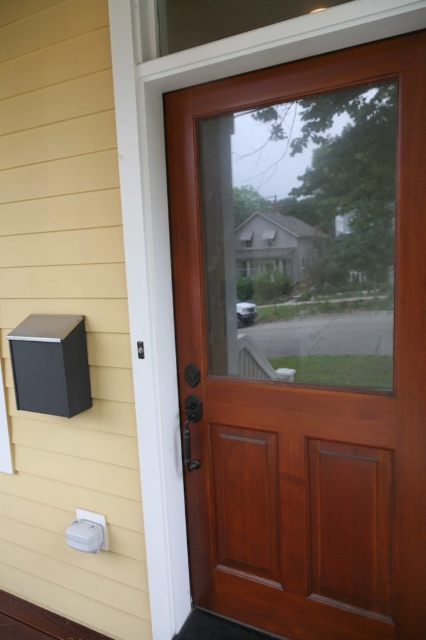
Between mahogany wood screen door at center and yellow siding at left, which one is positioned lower?

mahogany wood screen door at center

How much distance is there between mahogany wood screen door at center and yellow siding at left?

mahogany wood screen door at center is 23.29 inches away from yellow siding at left.

Between point (397, 218) and point (100, 499), which one is positioned in front?

Positioned in front is point (397, 218).

Find the location of a particular element. mahogany wood screen door at center is located at coordinates (305, 340).